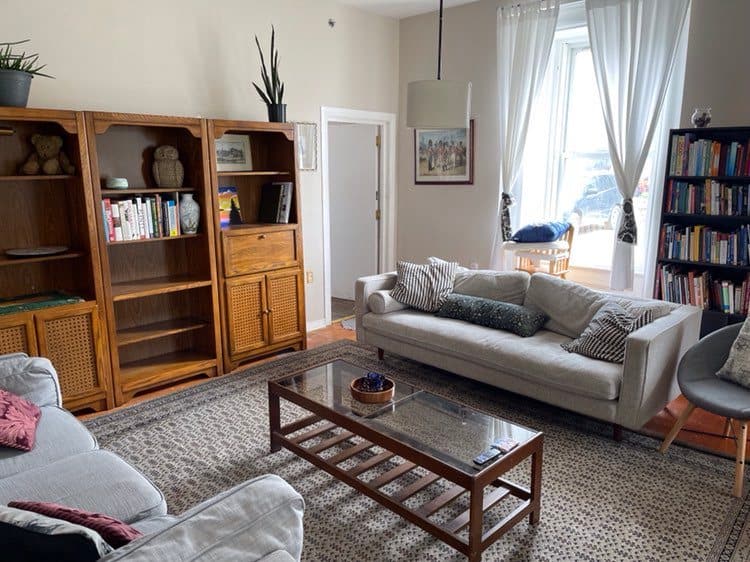
Locate an element on the screen. red pillow is located at coordinates (8, 435), (115, 522).